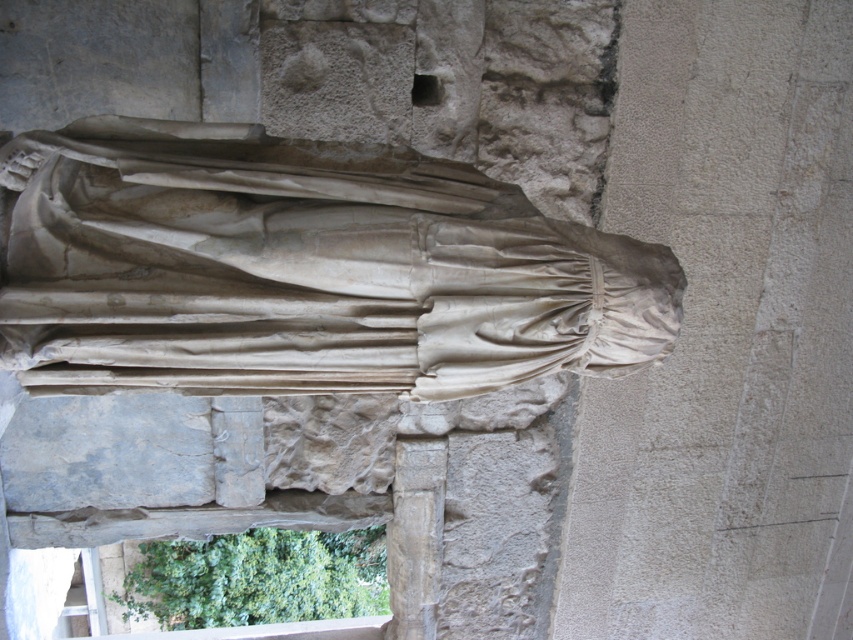
You are an archaeologist examining the ancient stone structure. You notice the white marble statue at center and the smooth stone column at center. Which object is located to the left of the other?

The white marble statue at center is positioned on the left side of the smooth stone column at center.

You are an archaeologist examining the ancient stone structure. You notice the white marble statue at center and the smooth stone column at center. Based on their positions, which one is positioned higher up?

The white marble statue at center is located above the smooth stone column at center, so it is positioned higher up.